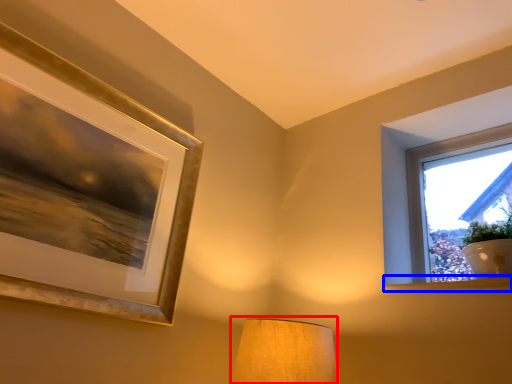
Question: Which point is further to the camera, lamp (highlighted by a red box) or window sill (highlighted by a blue box)?

Choices:
 (A) lamp
 (B) window sill

Answer: (B)